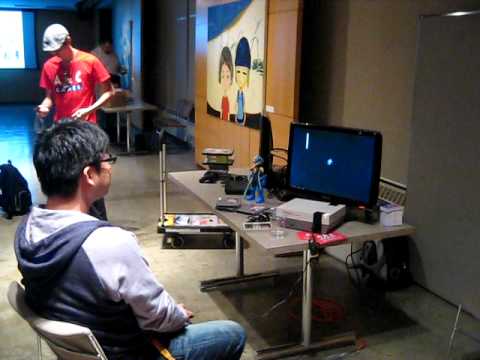
At what (x,y) coordinates should I click in order to perform the action: click on desk. Please return your answer as a coordinate pair (x, y). Looking at the image, I should click on (291, 242).